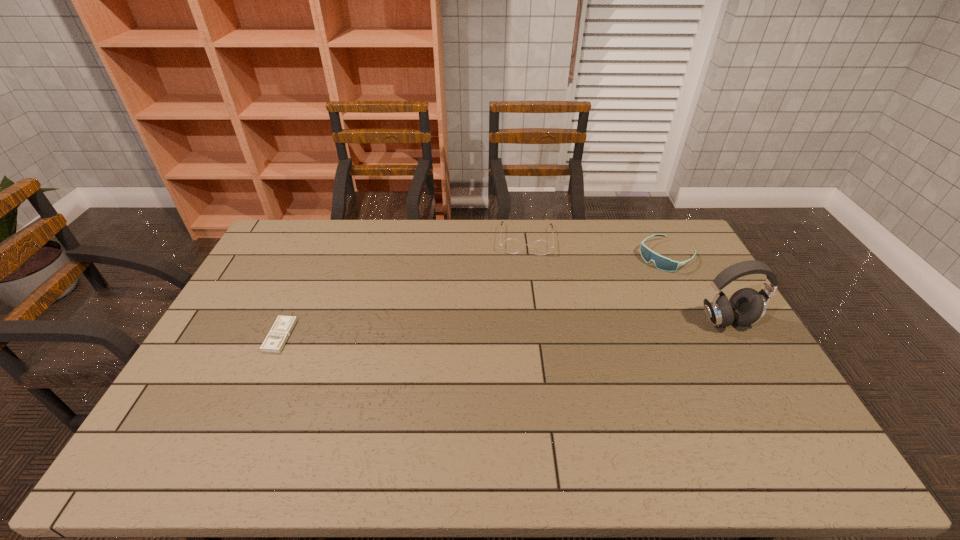
The image size is (960, 540). What are the coordinates of `vacant space on the desktop that is between the shortest object and the tallest object and is positioned on the front-facing side of the goggles` in the screenshot? It's located at (567, 326).

Image resolution: width=960 pixels, height=540 pixels. In order to click on vacant space on the desktop that is between the leftmost object and the headset and is positioned on the front-facing side of the second object from left to right in this screenshot , I will do `click(525, 327)`.